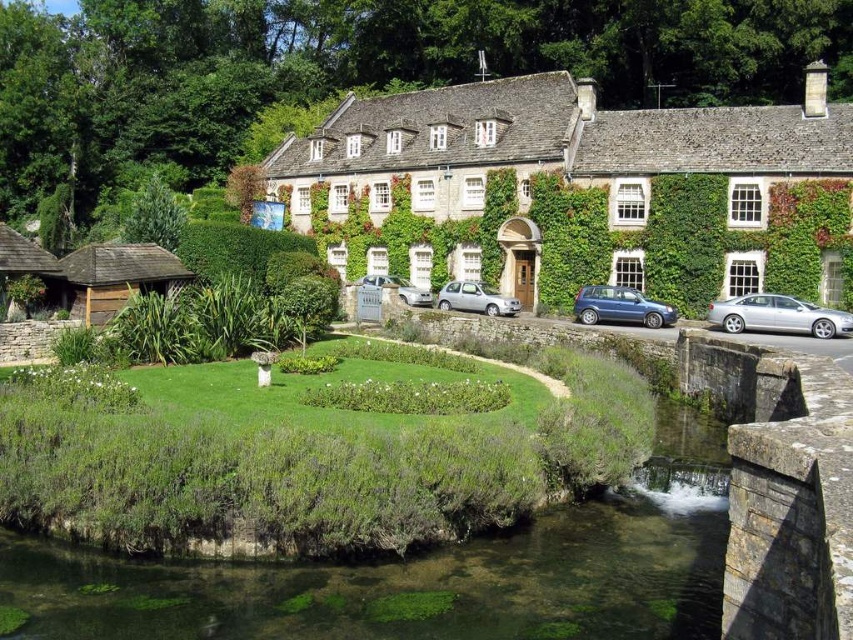
Can you confirm if silver metallic sedan at right is positioned to the left of silver metallic hatchback at center?

In fact, silver metallic sedan at right is to the right of silver metallic hatchback at center.

Is point (802, 300) positioned after point (450, 298)?

No, it is in front of (450, 298).

Does point (814, 337) come in front of point (508, 316)?

Yes, it is in front of point (508, 316).

The height and width of the screenshot is (640, 853). I want to click on silver metallic sedan at right, so click(776, 316).

Is silver metallic sedan at right bigger than metallic blue hatchback at center?

Yes, silver metallic sedan at right is bigger than metallic blue hatchback at center.

Who is more distant from viewer, (746, 307) or (630, 298)?

The point (630, 298) is behind.

Is point (735, 324) farther from camera compared to point (662, 321)?

No, it is not.

Find the location of `silver metallic sedan at right`. silver metallic sedan at right is located at coordinates (776, 316).

Can you confirm if green mossy stone river at lower center is bigger than metallic blue hatchback at center?

Yes, green mossy stone river at lower center is bigger than metallic blue hatchback at center.

Which of these two, green mossy stone river at lower center or metallic blue hatchback at center, stands shorter?

Standing shorter between the two is green mossy stone river at lower center.

Where is `green mossy stone river at lower center`? The width and height of the screenshot is (853, 640). green mossy stone river at lower center is located at coordinates (422, 573).

Find the location of a particular element. The height and width of the screenshot is (640, 853). green mossy stone river at lower center is located at coordinates (422, 573).